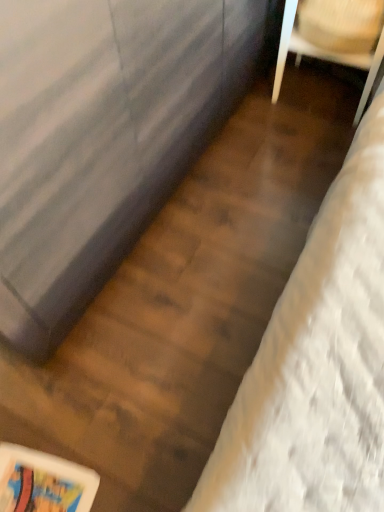
In order to click on vacant space underneath wooden chair at upper right (from a real-world perspective) in this screenshot , I will do `click(321, 88)`.